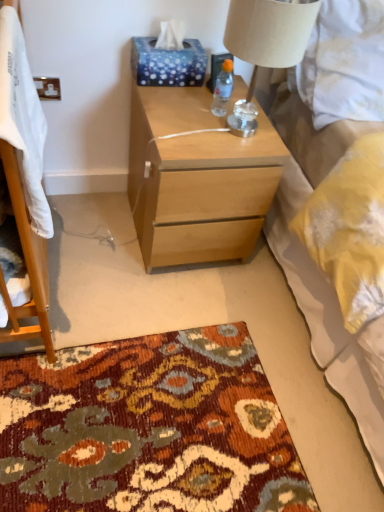
Find the location of a particular element. The image size is (384, 512). free point behind transparent plastic bottle at upper center is located at coordinates (215, 96).